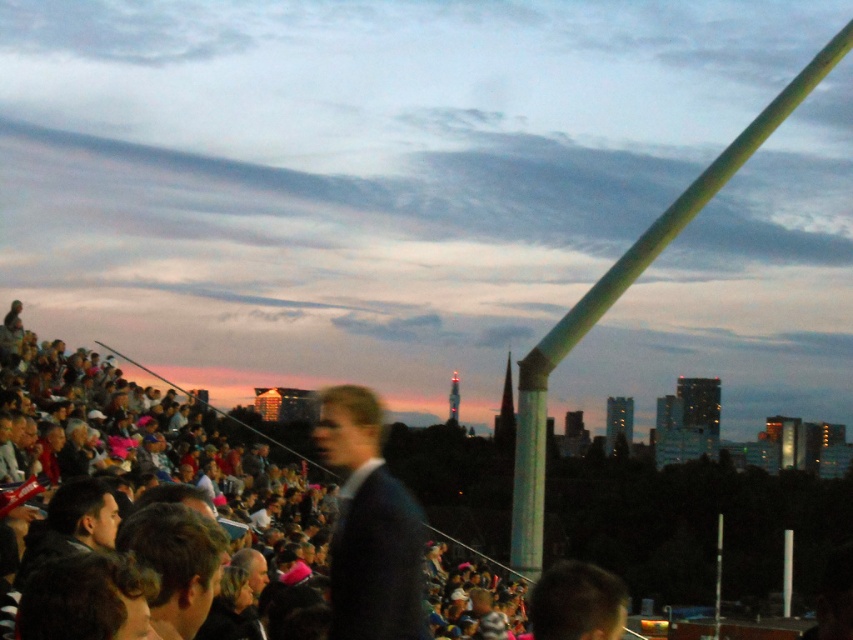
Is the position of dark blue suit at center more distant than that of green glossy pole at upper right?

No, it is not.

From the picture: Who is more forward, [351,435] or [531,513]?

Positioned in front is point [351,435].

Identify the location of dark blue suit at center. (369, 525).

Between dark blue suit at center and dark brown hair at center, which one has more height?

With more height is dark blue suit at center.

Does dark blue suit at center appear on the left side of dark brown hair at center?

In fact, dark blue suit at center is to the right of dark brown hair at center.

Which is behind, point (335, 554) or point (173, 628)?

Positioned behind is point (335, 554).

This screenshot has height=640, width=853. I want to click on dark blue suit at center, so click(x=369, y=525).

Who is more distant from viewer, [543,397] or [207,584]?

Point [543,397]

From the picture: Measure the distance from green glossy pole at upper right to dark brown hair at center.

green glossy pole at upper right and dark brown hair at center are 240.24 meters apart from each other.

Is point (728, 156) farther from camera compared to point (189, 518)?

Yes, it is behind point (189, 518).

Identify the location of green glossy pole at upper right. (619, 294).